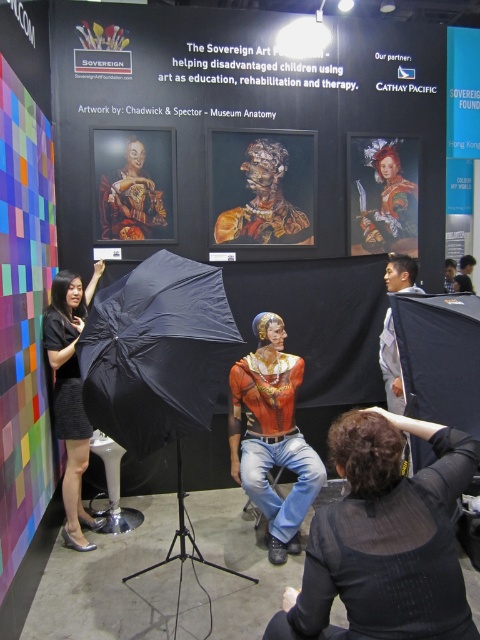
Question: Which point is farther to the camera?

Choices:
 (A) black fabric umbrella at left
 (B) matte gray suit at center
 (C) matte black umbrella at center

Answer: (C)

Question: Considering the relative positions of black fabric umbrella at left and matte black umbrella at center in the image provided, where is black fabric umbrella at left located with respect to matte black umbrella at center?

Choices:
 (A) right
 (B) left

Answer: (B)

Question: Among these points, which one is nearest to the camera?

Choices:
 (A) (396, 404)
 (B) (155, 348)
 (C) (269, 312)
 (D) (441, 582)

Answer: (D)

Question: Can you confirm if matte gray suit at center is smaller than matte black umbrella at center?

Choices:
 (A) no
 (B) yes

Answer: (A)

Question: Does matte red shirt at center appear over matte gray suit at center?

Choices:
 (A) no
 (B) yes

Answer: (A)

Question: Which point is closer to the camera?

Choices:
 (A) black fabric umbrella at left
 (B) black fabric umbrella at lower center
 (C) matte red shirt at center

Answer: (B)